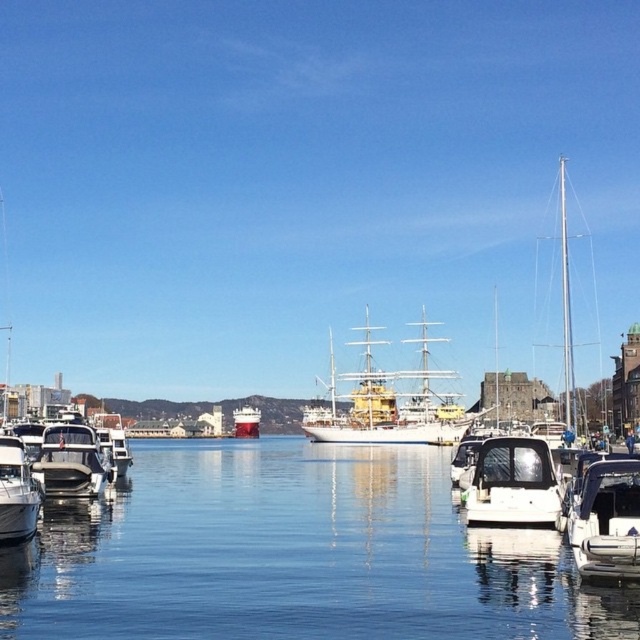
Question: Which point is farther to the camera?

Choices:
 (A) (83, 465)
 (B) (99, 429)
 (C) (605, 536)
 (D) (26, 506)

Answer: (B)

Question: In this image, where is white matte boat at left located relative to white glossy ship at center?

Choices:
 (A) below
 (B) above

Answer: (B)

Question: Which of the following is the closest to the observer?

Choices:
 (A) white matte boat at left
 (B) clear water at center
 (C) white glossy boat at lower left
 (D) white glossy boat at lower right

Answer: (B)

Question: Which point is farther to the camera?

Choices:
 (A) (422, 406)
 (B) (256, 420)

Answer: (B)

Question: Does white glossy boat at lower right appear on the left side of white matte boat at center?

Choices:
 (A) no
 (B) yes

Answer: (A)

Question: Is clear water at center smaller than white wooden ship at center?

Choices:
 (A) yes
 (B) no

Answer: (A)